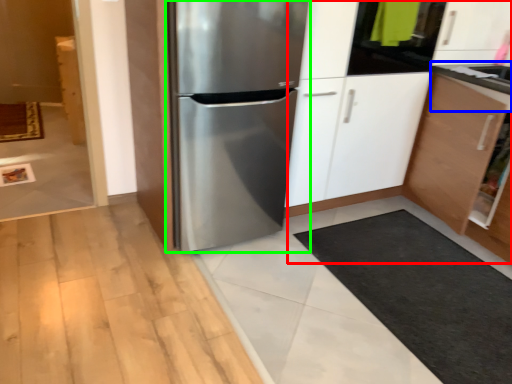
Question: Considering the real-world distances, which object is closest to dresser (highlighted by a red box)? counter top (highlighted by a blue box) or refrigerator (highlighted by a green box).

Choices:
 (A) counter top
 (B) refrigerator

Answer: (A)